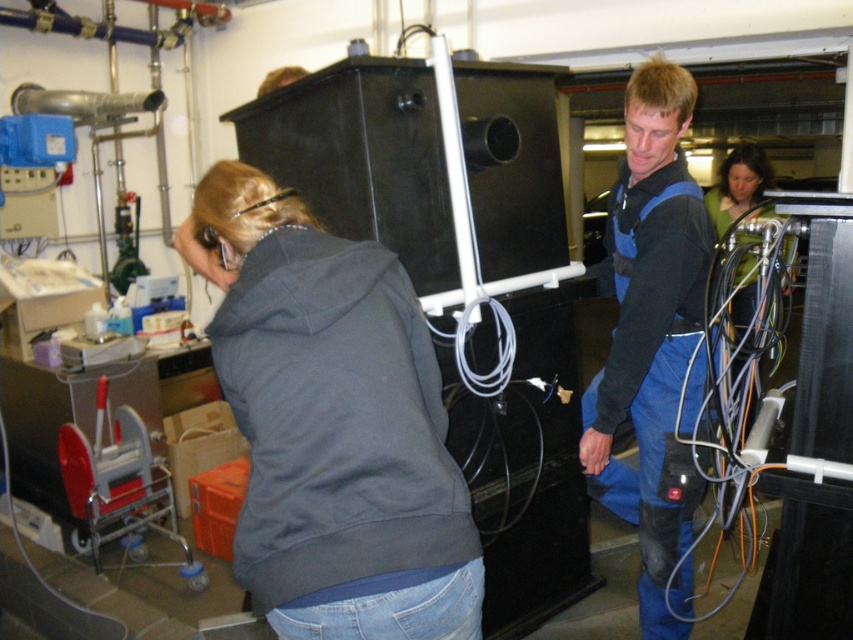
Question: Which of these objects is positioned farthest from the dark gray fleece sweatshirt at center?

Choices:
 (A) blue denim coveralls at center
 (B) black rubber wires at right

Answer: (A)

Question: Can you confirm if blue denim coveralls at center is smaller than black rubber wires at right?

Choices:
 (A) yes
 (B) no

Answer: (A)

Question: Which object appears closest to the camera in this image?

Choices:
 (A) black rubber wires at right
 (B) dark gray fleece sweatshirt at center
 (C) blue denim coveralls at center

Answer: (B)

Question: Is blue denim coveralls at center smaller than black rubber wires at right?

Choices:
 (A) no
 (B) yes

Answer: (B)

Question: Which object is closer to the camera taking this photo?

Choices:
 (A) blue denim coveralls at center
 (B) black rubber wires at right
 (C) dark gray fleece sweatshirt at center

Answer: (C)

Question: Is dark gray fleece sweatshirt at center thinner than black rubber wires at right?

Choices:
 (A) no
 (B) yes

Answer: (B)